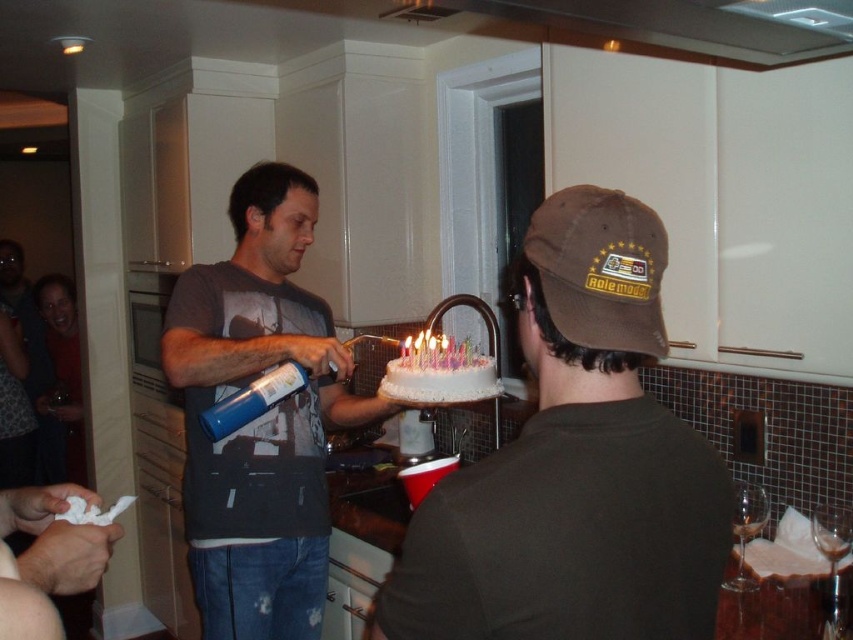
You are a guest at the birthday party and want to blow out the candles on the white frosted cake at center. The brown fabric baseball cap at upper right is in your way. Can you move around it to reach the cake?

The brown fabric baseball cap at upper right is closer to the viewer than the white frosted cake at center, so you can move around it to reach the cake since it is not blocking the entire path.

What is located at the coordinates point (x=575, y=465) in the image?

The brown cotton cap at center is located at point (x=575, y=465).